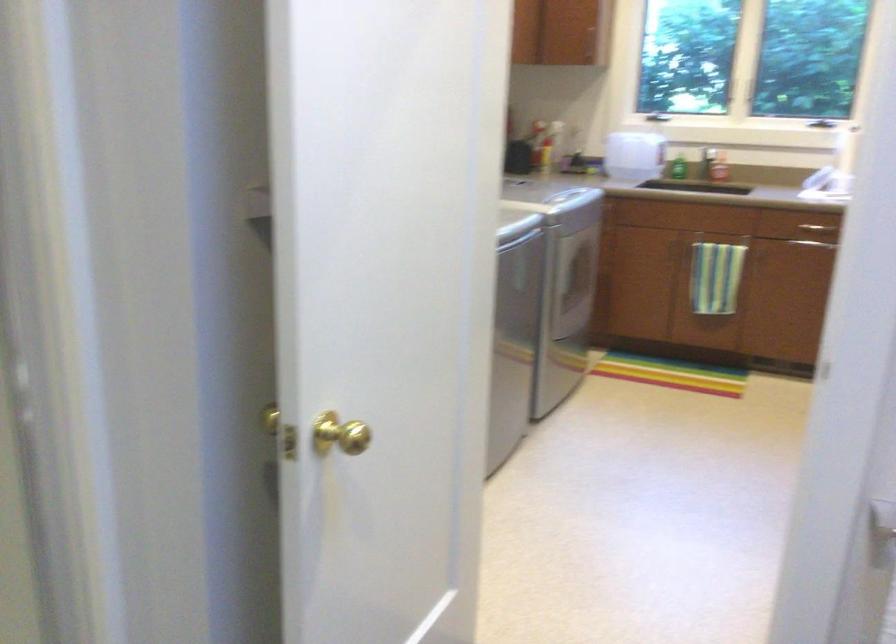
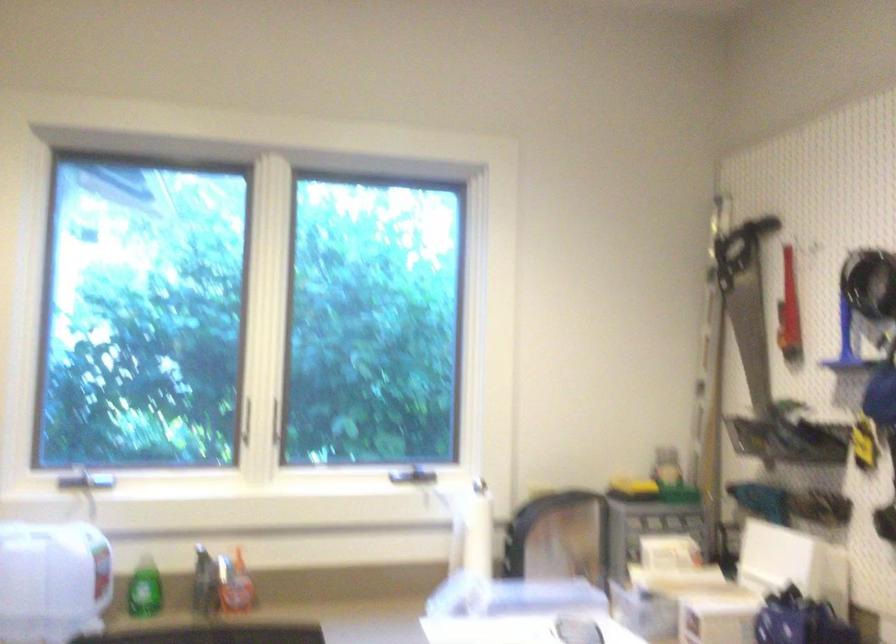
Where in the second image is the point corresponding to point (652, 109) from the first image?

(84, 478)